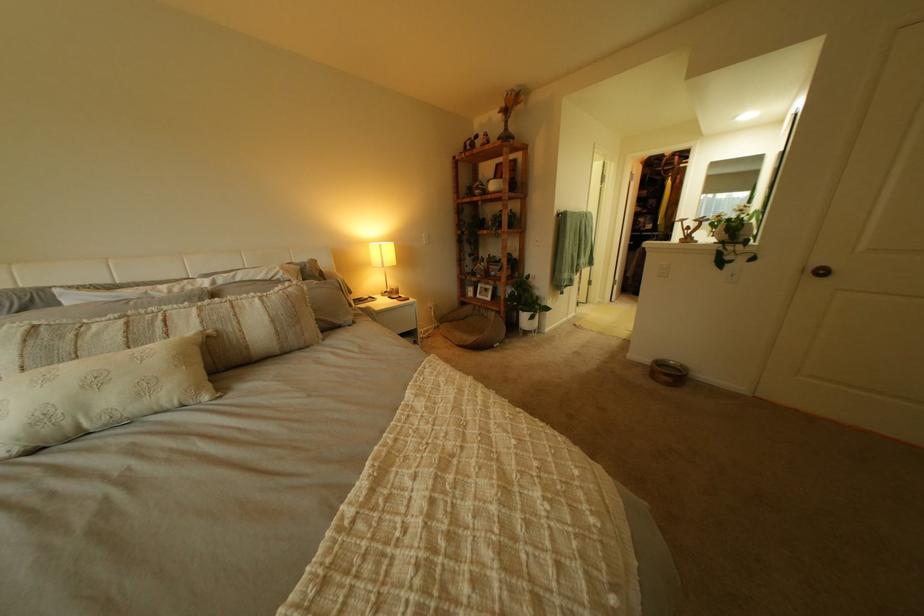
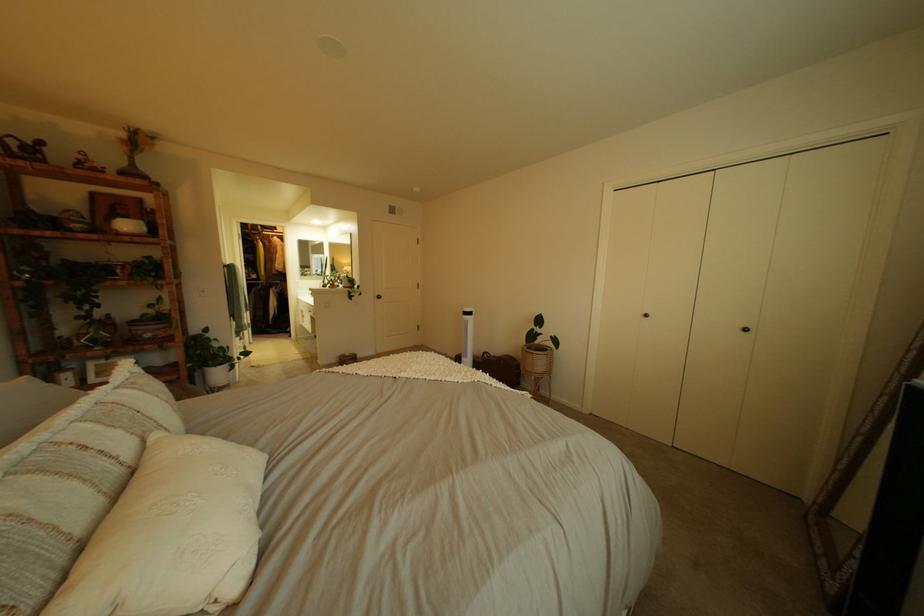
Where in the second image is the point corresponding to (x=509, y=257) from the first image?

(161, 315)